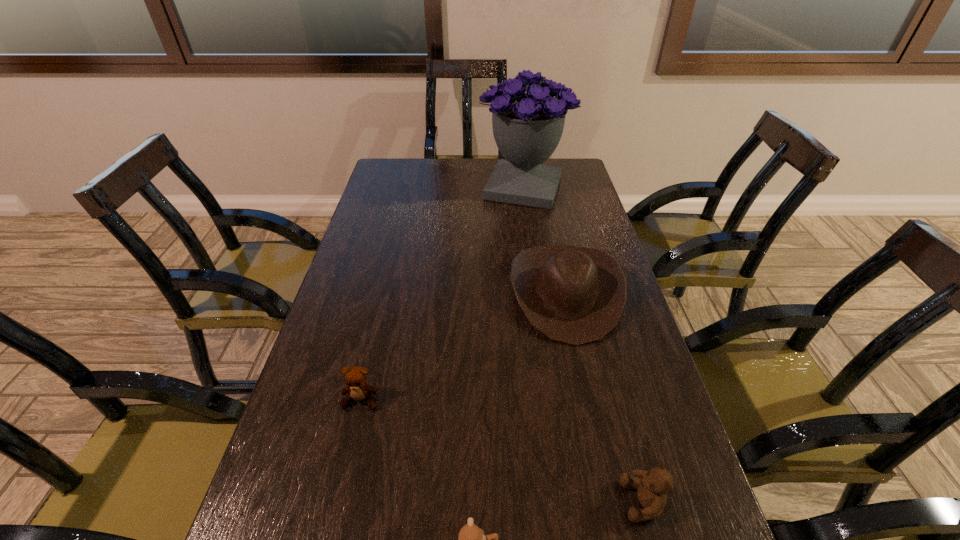
Where is `vacant space located on the front-facing side of the second nearest object`? This screenshot has height=540, width=960. vacant space located on the front-facing side of the second nearest object is located at coordinates (431, 501).

Locate an element on the screen. This screenshot has width=960, height=540. vacant space located on the front-facing side of the second nearest object is located at coordinates 540,501.

You are a GUI agent. You are given a task and a screenshot of the screen. Output one action in this format:
    pyautogui.click(x=<x>, y=<y>)
    Task: Click on the vacant region located 0.210m on the front-facing side of the second nearest object
    Image resolution: width=960 pixels, height=540 pixels.
    Given the screenshot: What is the action you would take?
    pyautogui.click(x=508, y=501)

Where is `free space located 0.190m on the front-facing side of the farthest teddy bear`? The image size is (960, 540). free space located 0.190m on the front-facing side of the farthest teddy bear is located at coordinates (336, 503).

The image size is (960, 540). I want to click on object that is at the far edge, so click(x=527, y=127).

The width and height of the screenshot is (960, 540). I want to click on object at the left edge, so click(x=356, y=377).

Image resolution: width=960 pixels, height=540 pixels. In order to click on bouquet located in the right edge section of the desktop in this screenshot , I will do `click(527, 127)`.

Where is `cowboy hat situated at the right edge`? cowboy hat situated at the right edge is located at coordinates (575, 295).

Locate an element on the screen. The height and width of the screenshot is (540, 960). teddy bear situated at the right edge is located at coordinates (652, 486).

This screenshot has width=960, height=540. Find the location of `object that is at the far right corner`. object that is at the far right corner is located at coordinates (527, 127).